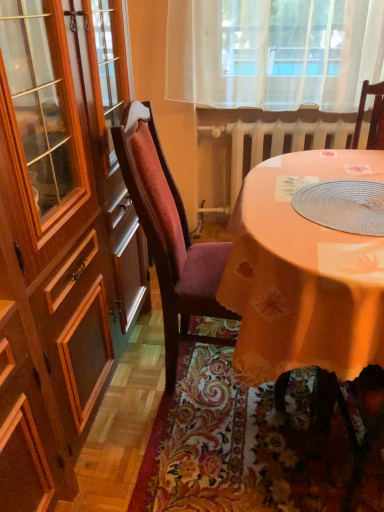
This screenshot has height=512, width=384. What are the coordinates of `vacant space in velvet burgundy chair at center (from a real-world perspective)` in the screenshot? It's located at (201, 366).